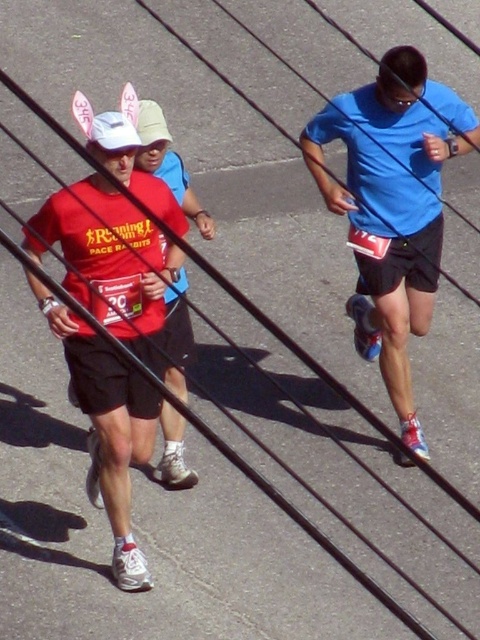
Who is positioned more to the left, blue matte shorts at center or matte red shirt at left?

matte red shirt at left is more to the left.

Is blue matte shorts at center behind matte red shirt at left?

Yes, it is.

Describe the element at coordinates (383, 253) in the screenshot. I see `blue matte shorts at center` at that location.

This screenshot has width=480, height=640. What are the coordinates of `blue matte shorts at center` in the screenshot? It's located at (383, 253).